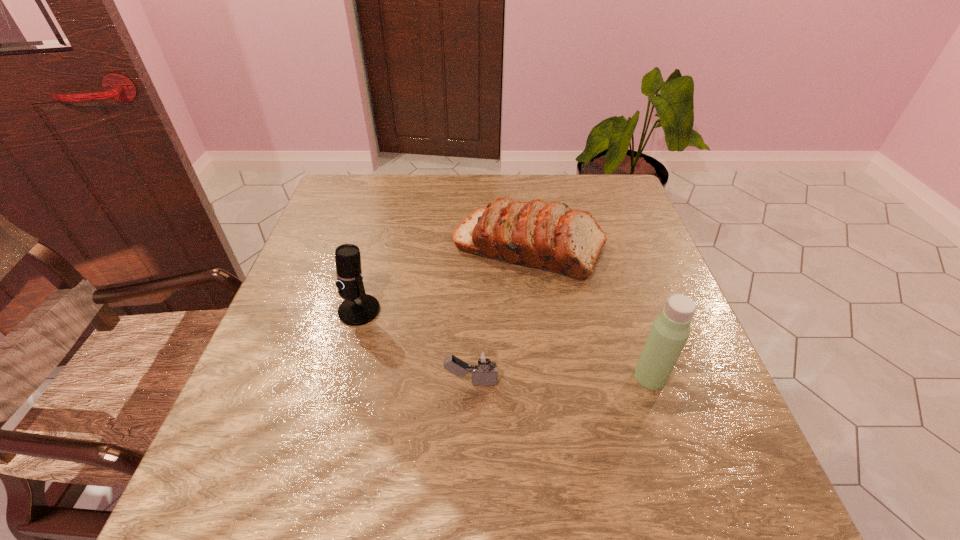
Identify the location of free space between the bread and the third shortest object. Image resolution: width=960 pixels, height=540 pixels. (444, 279).

You are a GUI agent. You are given a task and a screenshot of the screen. Output one action in this format:
    pyautogui.click(x=<x>, y=<y>)
    Task: Click on the free space between the thermos bottle and the second farthest object
    
    Given the screenshot: What is the action you would take?
    pyautogui.click(x=505, y=343)

At what (x,y) coordinates should I click in order to perform the action: click on vacant space that's between the bread and the leftmost object. Please return your answer as a coordinate pair (x, y). Looking at the image, I should click on (444, 279).

This screenshot has width=960, height=540. I want to click on vacant space in between the igniter and the second farthest object, so click(x=415, y=346).

Where is `free space between the bread and the tallest object`? free space between the bread and the tallest object is located at coordinates (589, 312).

Where is `free area in between the igniter and the leftmost object`? Image resolution: width=960 pixels, height=540 pixels. free area in between the igniter and the leftmost object is located at coordinates (415, 346).

Locate an element on the screen. free space between the tallest object and the shortest object is located at coordinates click(x=561, y=379).

Identify the location of free space between the farthest object and the igniter. (500, 314).

Find the location of a particular element. The image size is (960, 540). free space between the third nearest object and the thermos bottle is located at coordinates (505, 343).

Where is `free space between the tallest object and the microphone`? Image resolution: width=960 pixels, height=540 pixels. free space between the tallest object and the microphone is located at coordinates (505, 343).